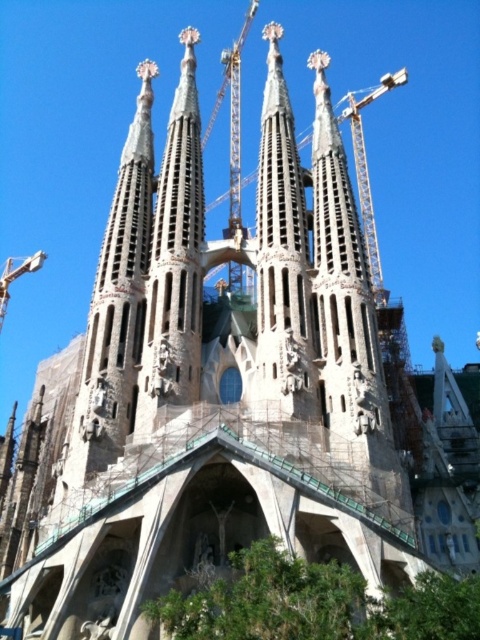
Question: Among these points, which one is nearest to the camera?

Choices:
 (A) (286, 268)
 (B) (224, 68)

Answer: (A)

Question: Is beige stone spire at center bigger than metallic construction crane at center?

Choices:
 (A) no
 (B) yes

Answer: (A)

Question: Does beige stone spire at center have a larger size compared to metallic construction crane at center?

Choices:
 (A) no
 (B) yes

Answer: (A)

Question: Is beige stone spire at center positioned at the back of metallic construction crane at center?

Choices:
 (A) no
 (B) yes

Answer: (A)